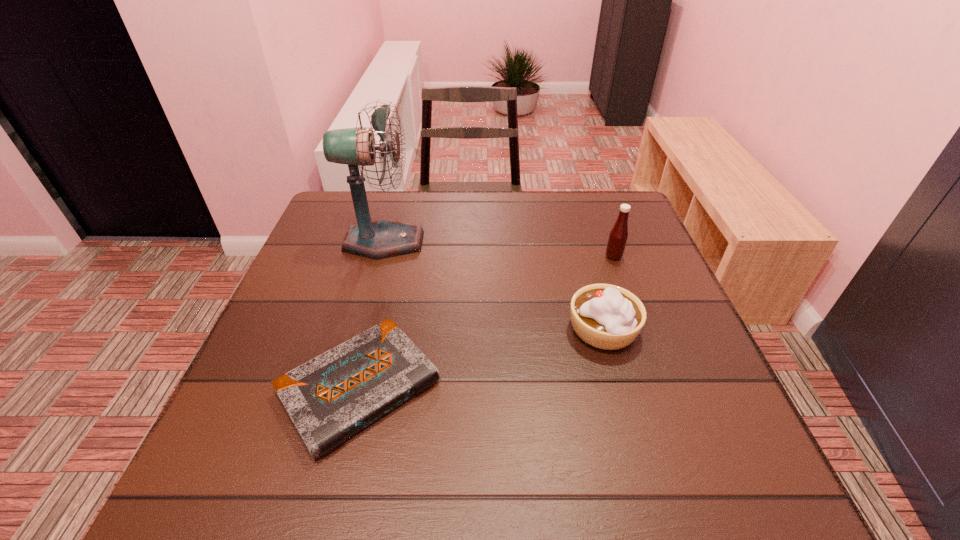
Find the location of a particular element. This screenshot has width=960, height=540. fan present at the left edge is located at coordinates (383, 238).

Where is `notebook at the left edge`? The height and width of the screenshot is (540, 960). notebook at the left edge is located at coordinates (330, 398).

You are a GUI agent. You are given a task and a screenshot of the screen. Output one action in this format:
    pyautogui.click(x=<x>, y=<y>)
    Task: Click on the Tabasco sauce present at the right edge
    Image resolution: width=960 pixels, height=540 pixels.
    Given the screenshot: What is the action you would take?
    coord(618,235)

At what (x,y) coordinates should I click in order to perform the action: click on whipped cream present at the right edge. Please return your answer as a coordinate pair (x, y). Looking at the image, I should click on (605, 316).

Where is `object that is positioned at the far left corner`? The height and width of the screenshot is (540, 960). object that is positioned at the far left corner is located at coordinates (383, 238).

Find the location of a particular element. object positioned at the near left corner is located at coordinates (330, 398).

Where is `vacant space at the far edge of the desktop`? The width and height of the screenshot is (960, 540). vacant space at the far edge of the desktop is located at coordinates (387, 201).

Identify the location of free space at the near edge of the desktop. coord(385,474).

The image size is (960, 540). What are the coordinates of `free spot at the left edge of the desktop` in the screenshot? It's located at (348, 258).

The height and width of the screenshot is (540, 960). In the image, there is a desktop. In order to click on free space at the right edge in this screenshot , I will do `click(660, 266)`.